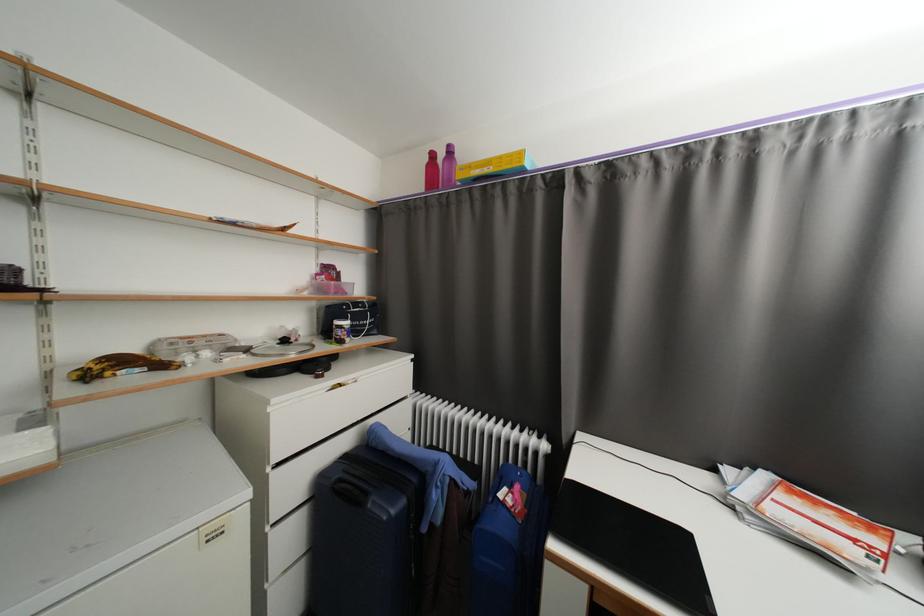
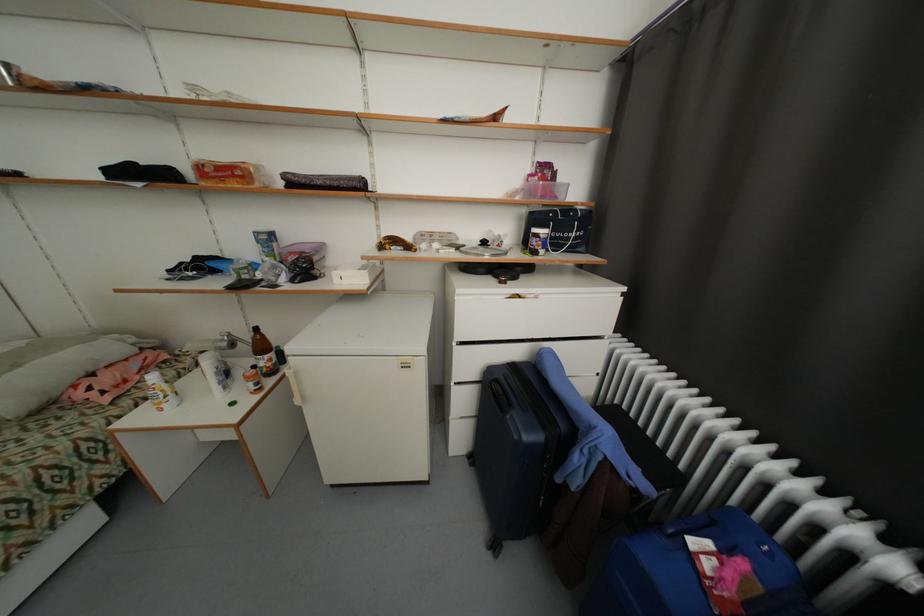
The images are taken continuously from a first-person perspective. In which direction is your viewpoint rotating?

The camera rotated toward left-down.